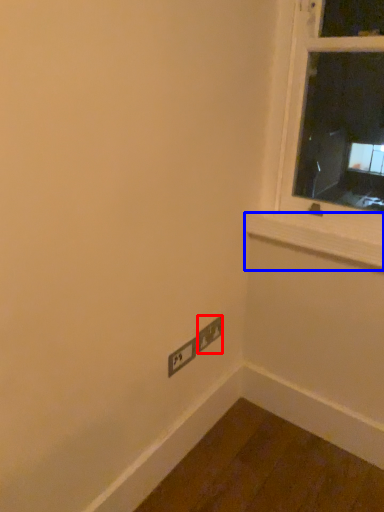
Question: Among these objects, which one is nearest to the camera, power plugs and sockets (highlighted by a red box) or window sill (highlighted by a blue box)?

Choices:
 (A) power plugs and sockets
 (B) window sill

Answer: (B)